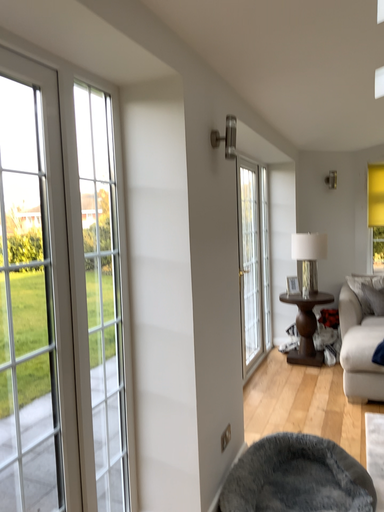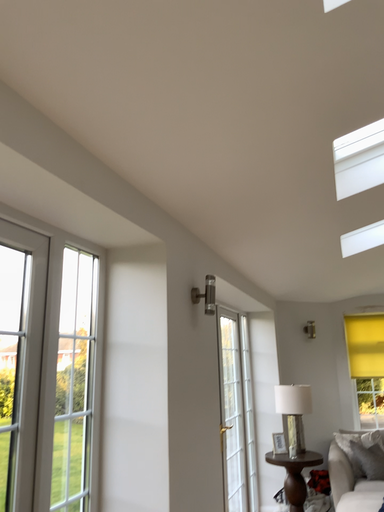
Question: Which way did the camera rotate in the video?

Choices:
 (A) rotated upward
 (B) rotated downward

Answer: (A)